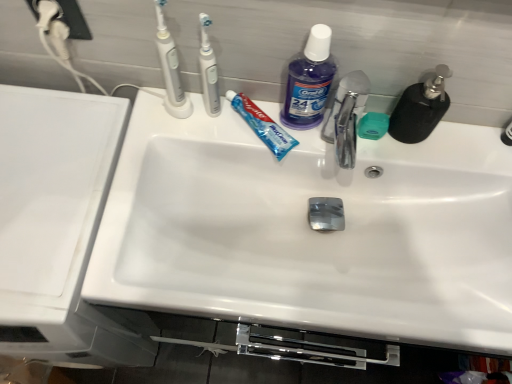
This screenshot has width=512, height=384. What are the coordinates of `free point to the right of green matte soap at center` in the screenshot? It's located at (449, 155).